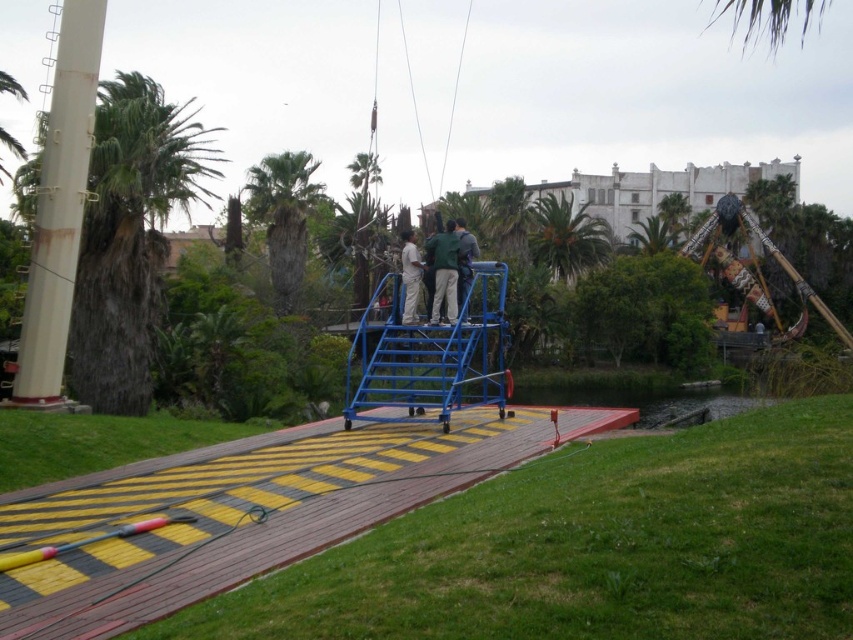
Does point (299, 196) come in front of point (544, 204)?

Yes, it is.

Does green textured palm tree at center appear on the left side of green leafy palm tree at upper center?

Indeed, green textured palm tree at center is positioned on the left side of green leafy palm tree at upper center.

Between point (305, 260) and point (566, 280), which one is positioned in front?

Point (305, 260)

The image size is (853, 640). What are the coordinates of `green textured palm tree at center` in the screenshot? It's located at (283, 218).

Is green leafy palm tree at left bigger than green fabric shirt at center?

Indeed, green leafy palm tree at left has a larger size compared to green fabric shirt at center.

Which is below, green leafy palm tree at left or green fabric shirt at center?

Positioned lower is green fabric shirt at center.

Image resolution: width=853 pixels, height=640 pixels. What do you see at coordinates (131, 237) in the screenshot?
I see `green leafy palm tree at left` at bounding box center [131, 237].

Where is `green leafy palm tree at left`? Image resolution: width=853 pixels, height=640 pixels. green leafy palm tree at left is located at coordinates (131, 237).

Is point (592, 264) positioned before point (635, 241)?

Yes, point (592, 264) is in front of point (635, 241).

Is green leafy palm tree at upper center bigger than green leafy palm tree at upper right?

Yes, green leafy palm tree at upper center is bigger than green leafy palm tree at upper right.

Does point (550, 218) come closer to viewer compared to point (653, 228)?

That is True.

Locate an element on the screen. The image size is (853, 640). green leafy palm tree at upper center is located at coordinates (566, 237).